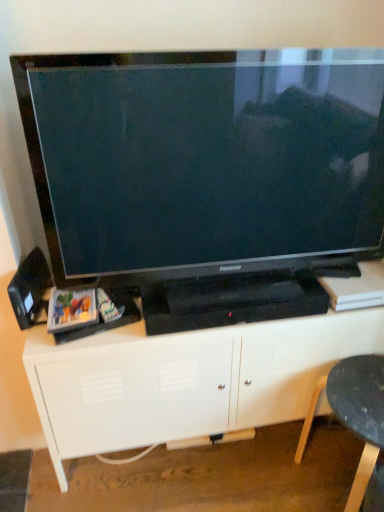
Question: Is black plastic chair at lower right inside or outside of black plastic speaker at left?

Choices:
 (A) outside
 (B) inside

Answer: (A)

Question: From the image's perspective, is black plastic chair at lower right positioned above or below black plastic speaker at left?

Choices:
 (A) above
 (B) below

Answer: (B)

Question: Which object is positioned farthest from the white matte entertainment center at center?

Choices:
 (A) black plastic chair at lower right
 (B) black plastic speaker at left
 (C) black glossy television at center

Answer: (B)

Question: Which of these objects is positioned farthest from the white matte entertainment center at center?

Choices:
 (A) black glossy television at center
 (B) black plastic speaker at left
 (C) black plastic chair at lower right

Answer: (B)